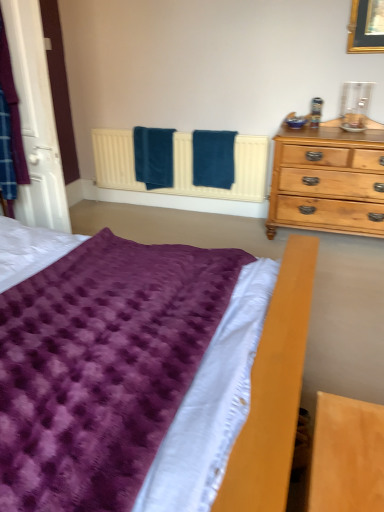
Question: Can you confirm if teal soft towel at center, the 2th bath towel positioned from the left, is shorter than blue soft towel at center, which is the first bath towel from left to right?

Choices:
 (A) yes
 (B) no

Answer: (B)

Question: Is teal soft towel at center, the 1th bath towel from the right, behind blue soft towel at center, marked as the second bath towel in a right-to-left arrangement?

Choices:
 (A) no
 (B) yes

Answer: (A)

Question: Does teal soft towel at center, the 1th bath towel from the right, turn towards blue soft towel at center, which is the first bath towel from left to right?

Choices:
 (A) no
 (B) yes

Answer: (A)

Question: Does teal soft towel at center, the 2th bath towel positioned from the left, appear on the left side of blue soft towel at center, which is the first bath towel from left to right?

Choices:
 (A) no
 (B) yes

Answer: (A)

Question: Can you confirm if teal soft towel at center, the 1th bath towel from the right, is smaller than blue soft towel at center, which is the first bath towel from left to right?

Choices:
 (A) yes
 (B) no

Answer: (A)

Question: From the image's perspective, is purple fuzzy blanket at lower left located above or below blue soft towel at center, which is the first bath towel from left to right?

Choices:
 (A) below
 (B) above

Answer: (A)

Question: In the image, is purple fuzzy blanket at lower left on the left side or the right side of blue soft towel at center, which is the first bath towel from left to right?

Choices:
 (A) right
 (B) left

Answer: (B)

Question: Looking at their shapes, would you say purple fuzzy blanket at lower left is wider or thinner than blue soft towel at center, which is the first bath towel from left to right?

Choices:
 (A) wide
 (B) thin

Answer: (A)

Question: In terms of height, does purple fuzzy blanket at lower left look taller or shorter compared to blue soft towel at center, which is the first bath towel from left to right?

Choices:
 (A) tall
 (B) short

Answer: (A)

Question: Considering the positions of blue soft towel at center, marked as the second bath towel in a right-to-left arrangement, and teal soft towel at center, the 2th bath towel positioned from the left, in the image, is blue soft towel at center, marked as the second bath towel in a right-to-left arrangement, bigger or smaller than teal soft towel at center, the 2th bath towel positioned from the left,?

Choices:
 (A) big
 (B) small

Answer: (A)

Question: From the image's perspective, relative to teal soft towel at center, the 2th bath towel positioned from the left, is blue soft towel at center, marked as the second bath towel in a right-to-left arrangement, above or below?

Choices:
 (A) above
 (B) below

Answer: (A)

Question: In the image, is blue soft towel at center, marked as the second bath towel in a right-to-left arrangement, positioned in front of or behind teal soft towel at center, the 2th bath towel positioned from the left?

Choices:
 (A) front
 (B) behind

Answer: (B)

Question: Is point (137, 134) closer or farther from the camera than point (215, 174)?

Choices:
 (A) closer
 (B) farther

Answer: (B)

Question: Considering the relative positions of teal soft towel at center, the 1th bath towel from the right, and purple fuzzy blanket at lower left in the image provided, is teal soft towel at center, the 1th bath towel from the right, to the left or to the right of purple fuzzy blanket at lower left?

Choices:
 (A) left
 (B) right

Answer: (B)

Question: From a real-world perspective, relative to purple fuzzy blanket at lower left, is teal soft towel at center, the 2th bath towel positioned from the left, vertically above or below?

Choices:
 (A) below
 (B) above

Answer: (A)